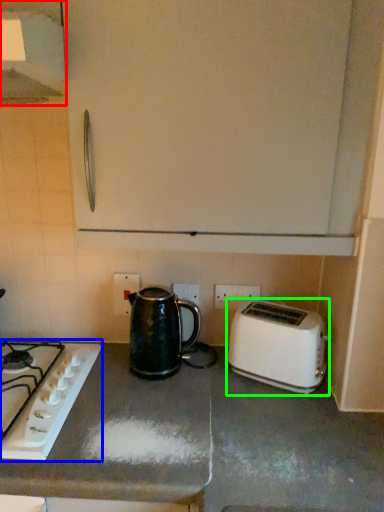
Question: Which is farther away from exhaust hood (highlighted by a red box)? gas stove (highlighted by a blue box) or toaster (highlighted by a green box)?

Choices:
 (A) gas stove
 (B) toaster

Answer: (B)